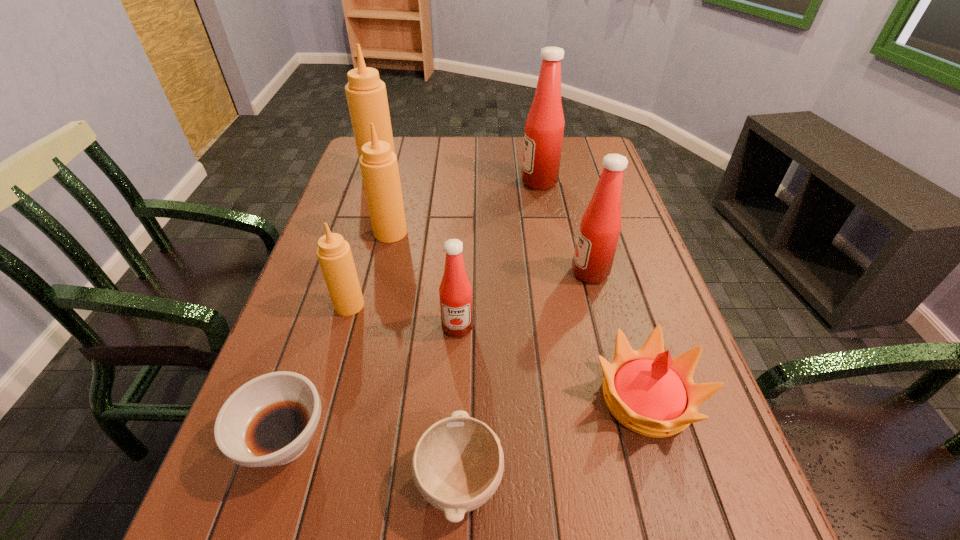
Find the location of a particular element. The height and width of the screenshot is (540, 960). the farthest red condiment is located at coordinates (544, 128).

Locate an element on the screen. the farthest tan condiment is located at coordinates (366, 94).

You are a GUI agent. You are given a task and a screenshot of the screen. Output one action in this format:
    pyautogui.click(x=<x>, y=<y>)
    Task: Click on the third farthest object
    
    Given the screenshot: What is the action you would take?
    pyautogui.click(x=379, y=167)

Locate an element on the screen. The width and height of the screenshot is (960, 540). the second smallest tan condiment is located at coordinates (379, 167).

This screenshot has height=540, width=960. In order to click on the second biggest red condiment in this screenshot , I will do pos(600,227).

Identify the location of the second nearest red condiment. This screenshot has height=540, width=960. (600, 227).

At what (x,y) coordinates should I click in order to perform the action: click on the smallest tan condiment. Please return your answer as a coordinate pair (x, y). Looking at the image, I should click on pos(334,254).

At what (x,y) coordinates should I click in order to perform the action: click on the nearest red condiment. Please return your answer as a coordinate pair (x, y). Looking at the image, I should click on (455, 291).

Locate an element on the screen. The width and height of the screenshot is (960, 540). the smallest red condiment is located at coordinates (455, 291).

Identify the location of crown. This screenshot has width=960, height=540. (650, 393).